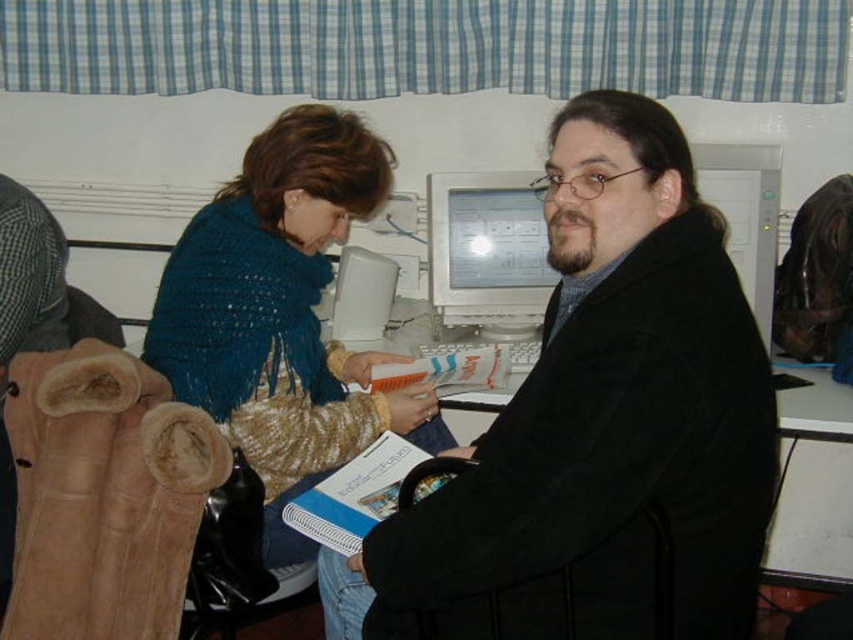
Question: Is black matte coat at center thinner than knitted blue scarf at left?

Choices:
 (A) no
 (B) yes

Answer: (A)

Question: Can you confirm if black matte coat at center is positioned above knitted blue scarf at left?

Choices:
 (A) yes
 (B) no

Answer: (B)

Question: Among these objects, which one is farthest from the camera?

Choices:
 (A) white plastic computer monitor at center
 (B) black matte coat at center

Answer: (A)

Question: Among these points, which one is farthest from the camera?

Choices:
 (A) (485, 179)
 (B) (560, 120)
 (C) (289, 160)

Answer: (A)

Question: Is black matte coat at center to the left of knitted blue scarf at left from the viewer's perspective?

Choices:
 (A) yes
 (B) no

Answer: (B)

Question: Which point is farther from the camera taking this photo?

Choices:
 (A) (537, 323)
 (B) (380, 173)
 (C) (631, 584)

Answer: (A)